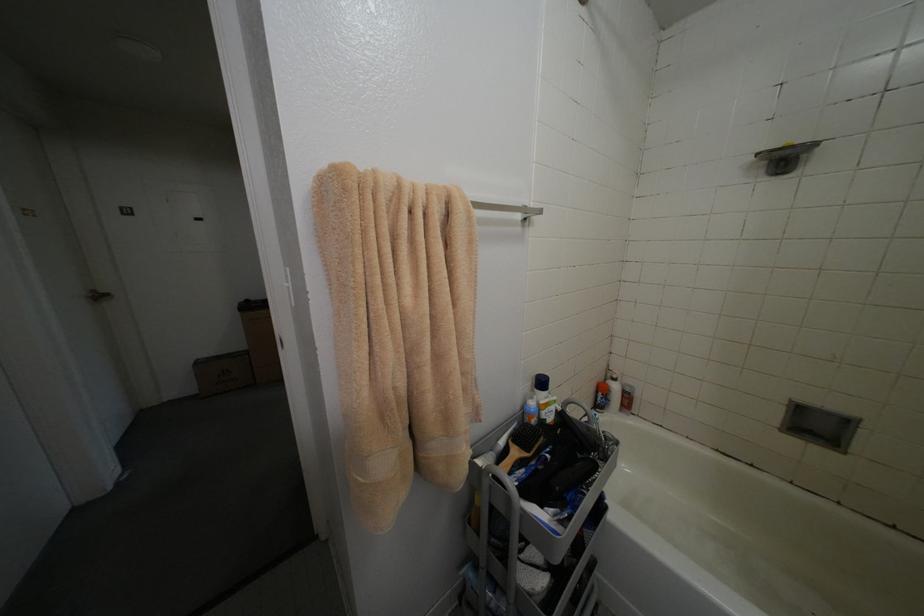
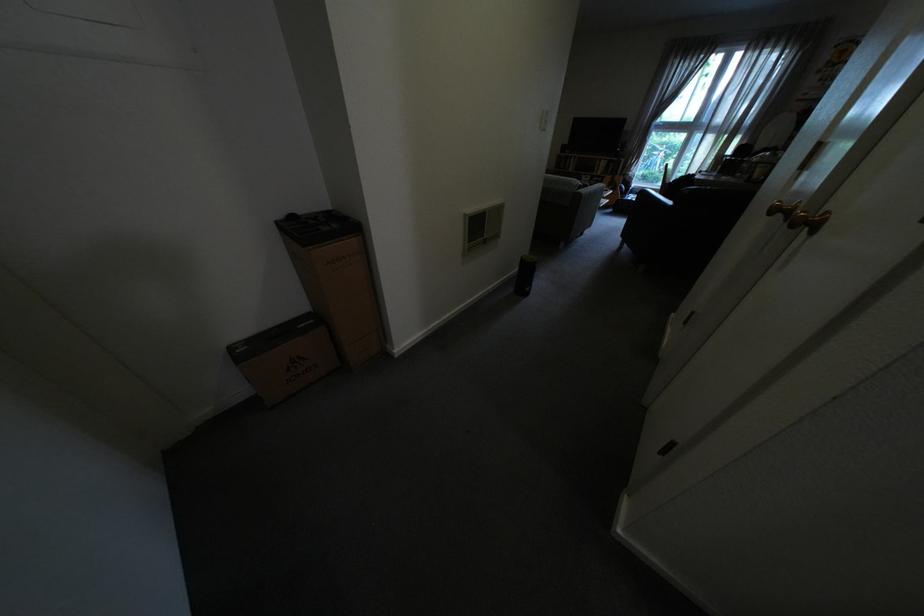
What movement of the cameraman would produce the second image?

The cameraman walked toward left, forward.